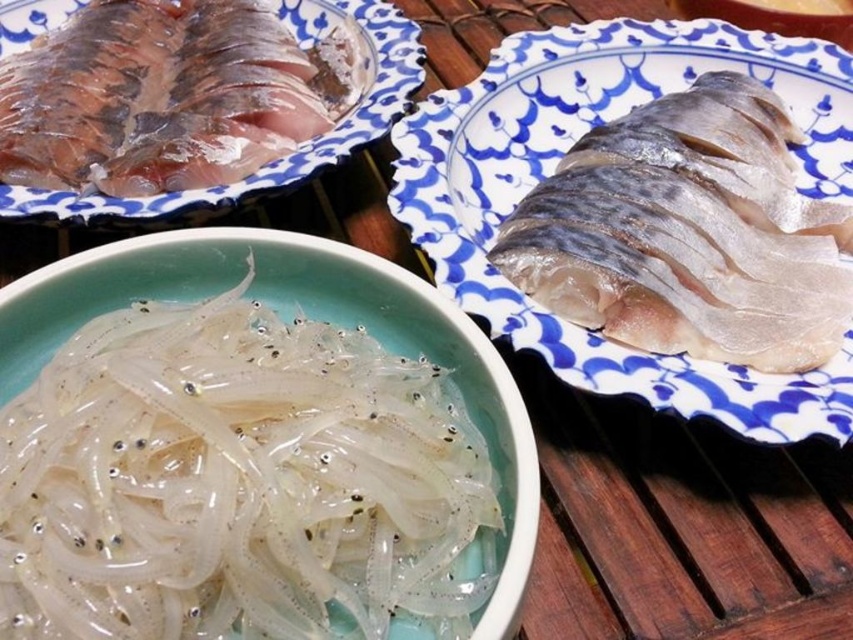
Between slick silver fish at upper right and shiny silver fish at upper left, which one is positioned lower?

slick silver fish at upper right

What do you see at coordinates (564, 152) in the screenshot? Image resolution: width=853 pixels, height=640 pixels. I see `slick silver fish at upper right` at bounding box center [564, 152].

Image resolution: width=853 pixels, height=640 pixels. I want to click on slick silver fish at upper right, so click(x=564, y=152).

I want to click on slick silver fish at upper right, so click(x=564, y=152).

Is point (537, 122) in front of point (463, 328)?

No.

Image resolution: width=853 pixels, height=640 pixels. Identify the location of slick silver fish at upper right. (564, 152).

This screenshot has height=640, width=853. Identify the location of translucent glass bowl at center. (358, 317).

At what (x,y) coordinates should I click in order to perform the action: click on translucent glass bowl at center. Please return your answer as a coordinate pair (x, y). This screenshot has width=853, height=640. Looking at the image, I should click on (358, 317).